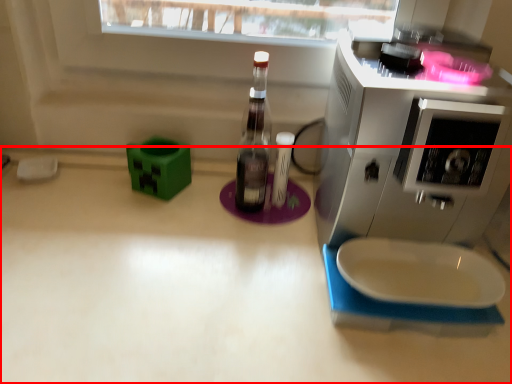
Question: Considering the relative positions of countertop (annotated by the red box) and home appliance in the image provided, where is countertop (annotated by the red box) located with respect to the staircase?

Choices:
 (A) right
 (B) left

Answer: (B)